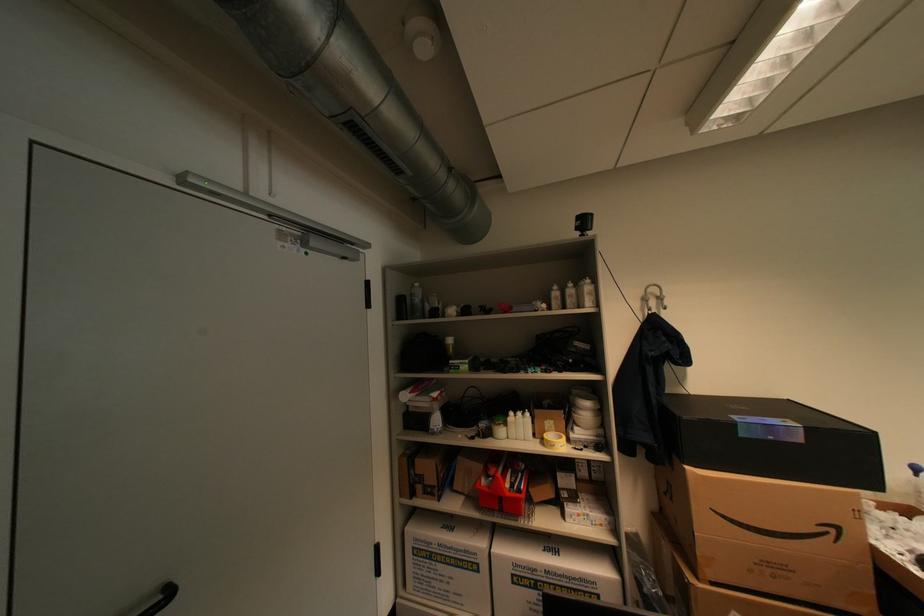
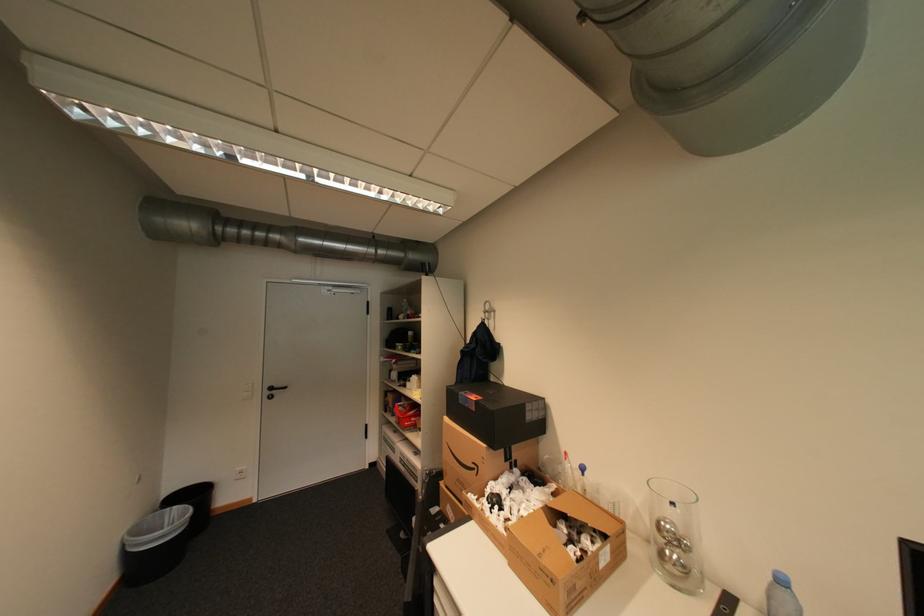
In the second image, find the point that corresponds to the point at 447,501 in the first image.

(400, 416)